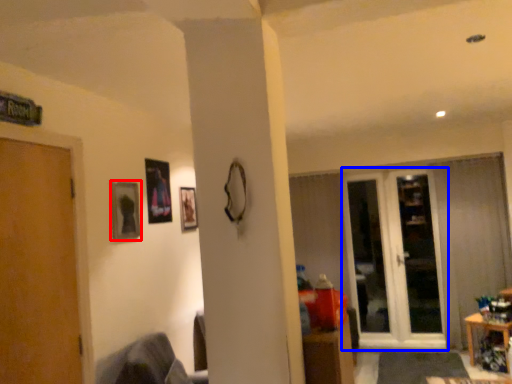
Question: Among these objects, which one is nearest to the camera, picture frame (highlighted by a red box) or glass door (highlighted by a blue box)?

Choices:
 (A) picture frame
 (B) glass door

Answer: (A)